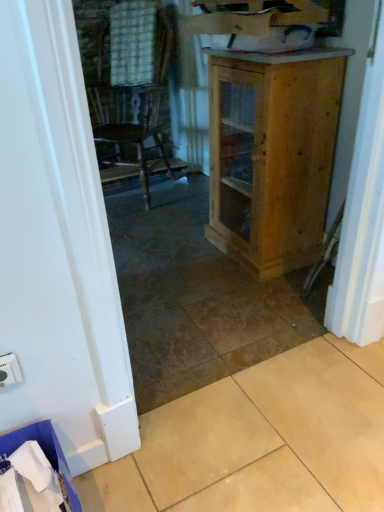
You are a GUI agent. You are given a task and a screenshot of the screen. Output one action in this format:
    pyautogui.click(x=<x>, y=<y>)
    Task: Click on the natural wood cabinet at center
    
    Given the screenshot: What is the action you would take?
    pyautogui.click(x=272, y=154)

I want to click on beige tile at lower right, so click(261, 440).

This screenshot has height=512, width=384. I want to click on white plastic electric outlet at lower left, so click(x=9, y=370).

Is beige tile at lower right at the left side of natural wood cabinet at center?

Indeed, beige tile at lower right is positioned on the left side of natural wood cabinet at center.

Could you tell me if beige tile at lower right is facing natural wood cabinet at center?

No, beige tile at lower right does not turn towards natural wood cabinet at center.

Is beige tile at lower right positioned beyond the bounds of natural wood cabinet at center?

beige tile at lower right is positioned outside natural wood cabinet at center.

Is beige tile at lower right directly adjacent to natural wood cabinet at center?

No, beige tile at lower right is not touching natural wood cabinet at center.

Does natural wood cabinet at center appear on the right side of beige tile at lower right?

Correct, you'll find natural wood cabinet at center to the right of beige tile at lower right.

Does natural wood cabinet at center turn towards beige tile at lower right?

No, natural wood cabinet at center is not oriented towards beige tile at lower right.

Between natural wood cabinet at center and beige tile at lower right, which one has smaller size?

beige tile at lower right.

Considering the sizes of objects natural wood cabinet at center and beige tile at lower right in the image provided, who is wider, natural wood cabinet at center or beige tile at lower right?

beige tile at lower right.

Who is more distant, white plastic electric outlet at lower left or natural wood cabinet at center?

natural wood cabinet at center is behind.

Would you say white plastic electric outlet at lower left is a long distance from natural wood cabinet at center?

Yes.

Is white plastic electric outlet at lower left aimed at natural wood cabinet at center?

No, white plastic electric outlet at lower left is not oriented towards natural wood cabinet at center.

I want to click on cabinetry lying on the right of white plastic electric outlet at lower left, so (x=272, y=154).

Is beige tile at lower right at the back of white plastic electric outlet at lower left?

No.

Identify the location of electric outlet located behind the beige tile at lower right. (9, 370).

Which object is closer to the camera, white plastic electric outlet at lower left or beige tile at lower right?

Positioned in front is beige tile at lower right.

Measure the distance between beige tile at lower right and white plastic electric outlet at lower left.

beige tile at lower right is 69.41 centimeters from white plastic electric outlet at lower left.

Looking at their sizes, would you say beige tile at lower right is wider or thinner than white plastic electric outlet at lower left?

beige tile at lower right is wider than white plastic electric outlet at lower left.

Which of these two, beige tile at lower right or white plastic electric outlet at lower left, stands taller?

beige tile at lower right is taller.

Which point is more distant from viewer, (237, 91) or (1, 369)?

The point (237, 91) is farther.

From the picture: Can you confirm if natural wood cabinet at center is positioned to the right of white plastic electric outlet at lower left?

Indeed, natural wood cabinet at center is positioned on the right side of white plastic electric outlet at lower left.

Between natural wood cabinet at center and white plastic electric outlet at lower left, which one has less height?

Standing shorter between the two is white plastic electric outlet at lower left.

Is white plastic electric outlet at lower left located within natural wood cabinet at center?

No, white plastic electric outlet at lower left is not inside natural wood cabinet at center.

Identify the location of tile below the natural wood cabinet at center (from a real-world perspective). (261, 440).

Where is `cabinetry on the right of beige tile at lower right`? Image resolution: width=384 pixels, height=512 pixels. cabinetry on the right of beige tile at lower right is located at coordinates (272, 154).

Based on their spatial positions, is natural wood cabinet at center or beige tile at lower right further from white plastic electric outlet at lower left?

Based on the image, natural wood cabinet at center appears to be further to white plastic electric outlet at lower left.

From the image, which object appears to be nearer to natural wood cabinet at center, beige tile at lower right or white plastic electric outlet at lower left?

Based on the image, beige tile at lower right appears to be nearer to natural wood cabinet at center.

Estimate the real-world distances between objects in this image. Which object is closer to beige tile at lower right, white plastic electric outlet at lower left or natural wood cabinet at center?

Among the two, white plastic electric outlet at lower left is located nearer to beige tile at lower right.

Based on their spatial positions, is natural wood cabinet at center or white plastic electric outlet at lower left further from beige tile at lower right?

Among the two, natural wood cabinet at center is located further to beige tile at lower right.

Looking at the image, which one is located further to white plastic electric outlet at lower left, beige tile at lower right or natural wood cabinet at center?

natural wood cabinet at center.

Based on their spatial positions, is white plastic electric outlet at lower left or beige tile at lower right further from natural wood cabinet at center?

white plastic electric outlet at lower left is positioned further to the anchor natural wood cabinet at center.

Where is `electric outlet that lies between natural wood cabinet at center and beige tile at lower right from top to bottom`? Image resolution: width=384 pixels, height=512 pixels. electric outlet that lies between natural wood cabinet at center and beige tile at lower right from top to bottom is located at coordinates (9, 370).